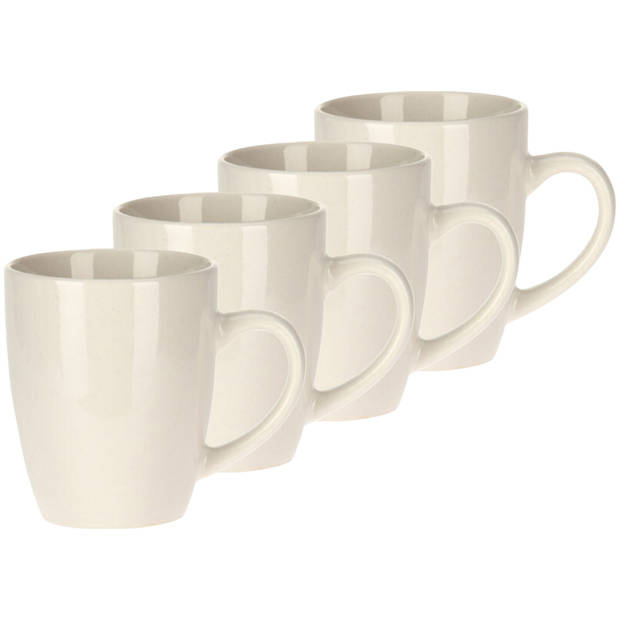
This screenshot has height=620, width=620. Identify the location of handles of the coffee cups. (294, 348), (405, 296), (508, 255), (609, 215).